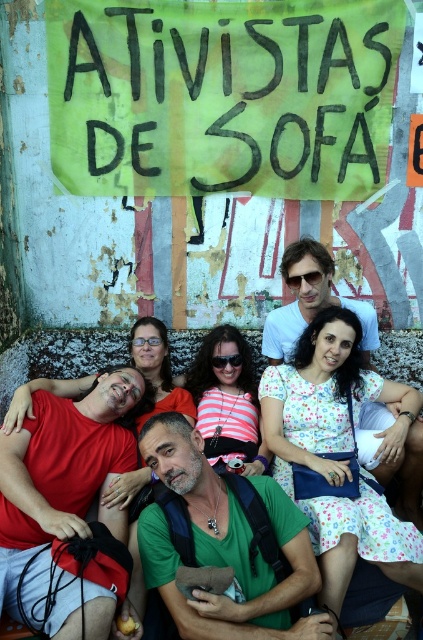
Who is positioned more to the right, matte red t-shirt at center or matte white shirt at center?

matte white shirt at center is more to the right.

Is point (120, 428) in front of point (412, 428)?

Yes, point (120, 428) is in front of point (412, 428).

The width and height of the screenshot is (423, 640). In order to click on matte red t-shirt at center in this screenshot , I will do coord(63,465).

In the scene shown: Which is above, green painted cardboard sign at upper center or matte white shirt at center?

green painted cardboard sign at upper center

Based on the photo, can you confirm if green painted cardboard sign at upper center is thinner than matte white shirt at center?

In fact, green painted cardboard sign at upper center might be wider than matte white shirt at center.

Measure the distance between point (184, 4) and camera.

A distance of 4.59 meters exists between point (184, 4) and camera.

The image size is (423, 640). I want to click on green painted cardboard sign at upper center, so click(x=222, y=96).

Who is higher up, green fabric shirt at center or matte white shirt at center?

matte white shirt at center is above.

Describe the element at coordinates (222, 545) in the screenshot. I see `green fabric shirt at center` at that location.

Does point (283, 522) come in front of point (368, 316)?

Yes.

Identify the location of green fabric shirt at center. pos(222,545).